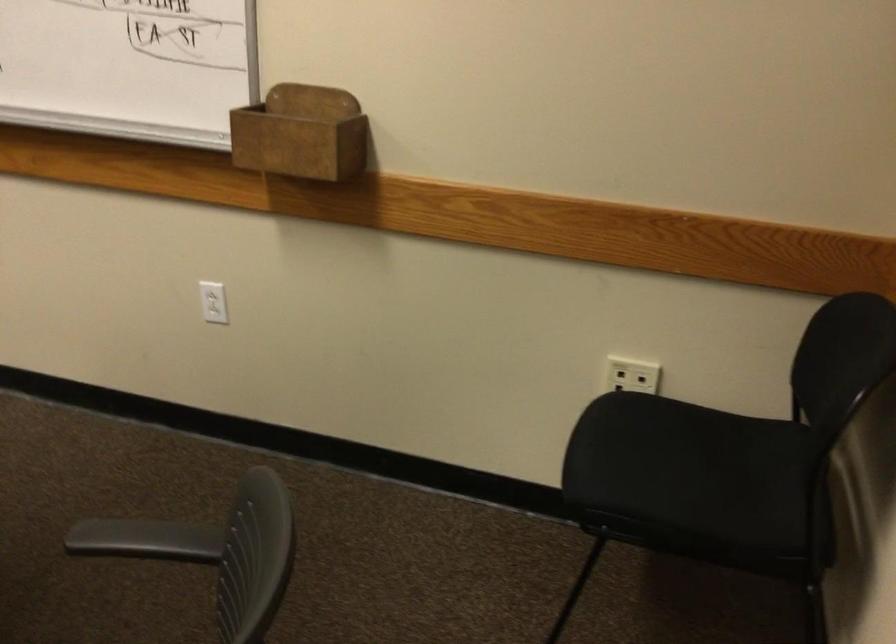
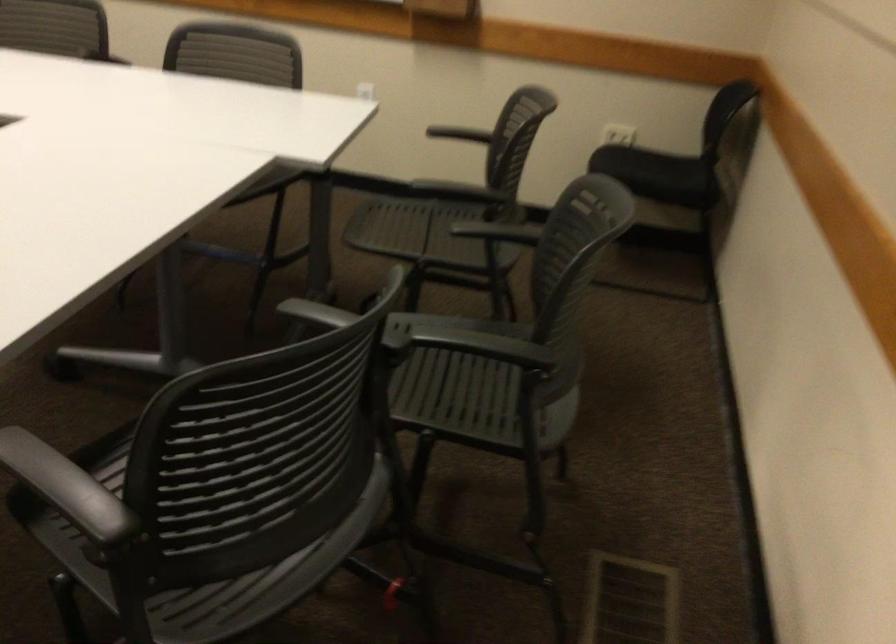
Locate, in the second image, the point that corresponds to (377,359) in the first image.

(464, 131)